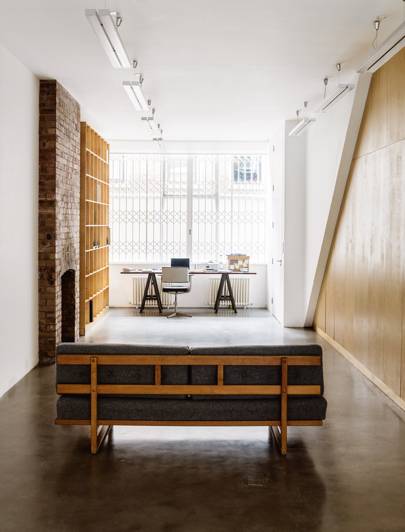
Where is `light brown wood wall`? This screenshot has height=532, width=405. light brown wood wall is located at coordinates (399, 274).